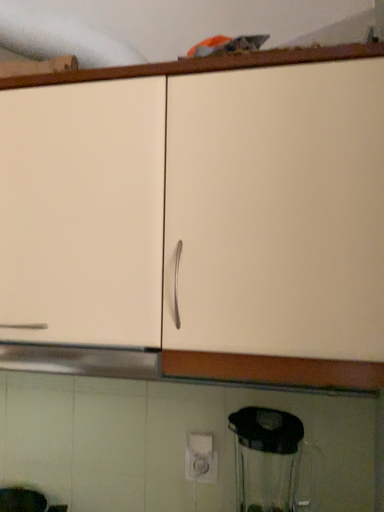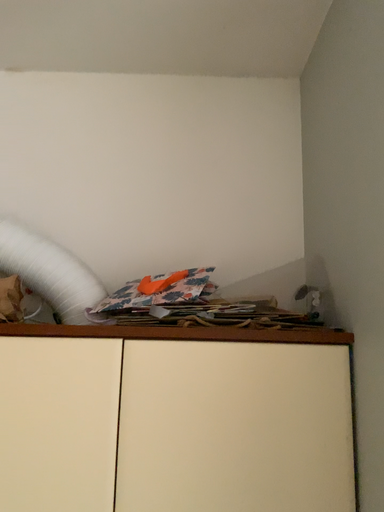
Question: How did the camera likely rotate when shooting the video?

Choices:
 (A) rotated downward
 (B) rotated upward

Answer: (B)